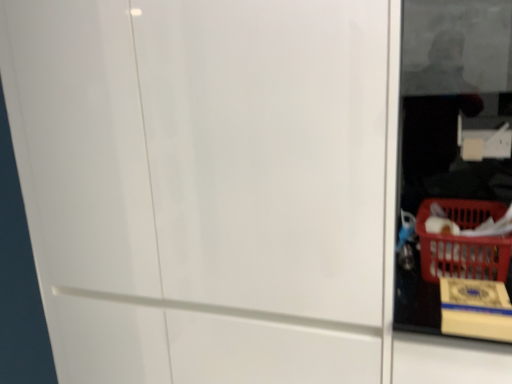
What is the approximate height of red plastic basket at lower right?

The height of red plastic basket at lower right is 20.11 centimeters.

This screenshot has width=512, height=384. In order to click on red plastic basket at lower right in this screenshot , I will do `click(463, 242)`.

Measure the distance between yellow cardboard box at lower right and camera.

35.94 inches.

I want to click on white glossy screen door at center, so click(267, 152).

From the image's perspective, which is below, white glossy screen door at center or yellow cardboard box at lower right?

From the image's view, yellow cardboard box at lower right is below.

Looking at their sizes, would you say white glossy screen door at center is wider or thinner than yellow cardboard box at lower right?

Clearly, white glossy screen door at center has more width compared to yellow cardboard box at lower right.

Is white glossy screen door at center not close to yellow cardboard box at lower right?

No, there isn't a large distance between white glossy screen door at center and yellow cardboard box at lower right.

Is white glossy screen door at center outside of yellow cardboard box at lower right?

Yes, white glossy screen door at center is located beyond the bounds of yellow cardboard box at lower right.

Which object is wider, yellow cardboard box at lower right or white glossy screen door at center?

Wider between the two is white glossy screen door at center.

Is yellow cardboard box at lower right to the left of white glossy screen door at center from the viewer's perspective?

In fact, yellow cardboard box at lower right is to the right of white glossy screen door at center.

How different are the orientations of yellow cardboard box at lower right and white glossy screen door at center in degrees?

yellow cardboard box at lower right and white glossy screen door at center are facing 0.559 degrees away from each other.

Is yellow cardboard box at lower right positioned with its back to white glossy screen door at center?

No.

Relative to yellow cardboard box at lower right, is red plastic basket at lower right in front or behind?

red plastic basket at lower right is behind yellow cardboard box at lower right.

Who is taller, red plastic basket at lower right or yellow cardboard box at lower right?

red plastic basket at lower right is taller.

Is red plastic basket at lower right outside of yellow cardboard box at lower right?

red plastic basket at lower right lies outside yellow cardboard box at lower right's area.

Based on the photo, from a real-world perspective, who is located lower, yellow cardboard box at lower right or red plastic basket at lower right?

yellow cardboard box at lower right, from a real-world perspective.

Can you confirm if yellow cardboard box at lower right is smaller than red plastic basket at lower right?

Indeed, yellow cardboard box at lower right has a smaller size compared to red plastic basket at lower right.

Consider the image. Does yellow cardboard box at lower right have a lesser height compared to red plastic basket at lower right?

Yes.

Is yellow cardboard box at lower right not close to red plastic basket at lower right?

They are positioned close to each other.

Looking at this image, is white glossy screen door at center thinner than red plastic basket at lower right?

Incorrect, the width of white glossy screen door at center is not less than that of red plastic basket at lower right.

Does white glossy screen door at center contain red plastic basket at lower right?

No, white glossy screen door at center does not contain red plastic basket at lower right.

From a real-world perspective, does white glossy screen door at center stand above red plastic basket at lower right?

No.

Who is bigger, red plastic basket at lower right or white glossy screen door at center?

white glossy screen door at center is bigger.

Is the surface of red plastic basket at lower right in direct contact with white glossy screen door at center?

No, red plastic basket at lower right is not making contact with white glossy screen door at center.

From a real-world perspective, which is physically below, red plastic basket at lower right or white glossy screen door at center?

white glossy screen door at center is physically lower.

Considering the relative sizes of red plastic basket at lower right and white glossy screen door at center in the image provided, is red plastic basket at lower right shorter than white glossy screen door at center?

Yes.

You are a GUI agent. You are given a task and a screenshot of the screen. Output one action in this format:
    pyautogui.click(x=<x>, y=<y>)
    Task: Click on the cardboard box that is under the white glossy screen door at center (from a real-world perspective)
    The width and height of the screenshot is (512, 384).
    Given the screenshot: What is the action you would take?
    pyautogui.click(x=475, y=309)

Identify the location of cardboard box lying below the white glossy screen door at center (from the image's perspective). Image resolution: width=512 pixels, height=384 pixels. pos(475,309).

Estimate the real-world distances between objects in this image. Which object is closer to yellow cardboard box at lower right, white glossy screen door at center or red plastic basket at lower right?

red plastic basket at lower right.

Consider the image. Which object lies further to the anchor point white glossy screen door at center, red plastic basket at lower right or yellow cardboard box at lower right?

red plastic basket at lower right lies further to white glossy screen door at center than the other object.

Considering their positions, is red plastic basket at lower right positioned closer to yellow cardboard box at lower right than white glossy screen door at center?

red plastic basket at lower right.

Estimate the real-world distances between objects in this image. Which object is closer to white glossy screen door at center, yellow cardboard box at lower right or red plastic basket at lower right?

yellow cardboard box at lower right lies closer to white glossy screen door at center than the other object.

Looking at the image, which one is located further to red plastic basket at lower right, yellow cardboard box at lower right or white glossy screen door at center?

white glossy screen door at center is positioned further to the anchor red plastic basket at lower right.

Estimate the real-world distances between objects in this image. Which object is further from red plastic basket at lower right, white glossy screen door at center or yellow cardboard box at lower right?

Among the two, white glossy screen door at center is located further to red plastic basket at lower right.

You are a GUI agent. You are given a task and a screenshot of the screen. Output one action in this format:
    pyautogui.click(x=<x>, y=<y>)
    Task: Click on the cardboard box between white glossy screen door at center and red plastic basket at lower right from left to right
    
    Given the screenshot: What is the action you would take?
    pyautogui.click(x=475, y=309)